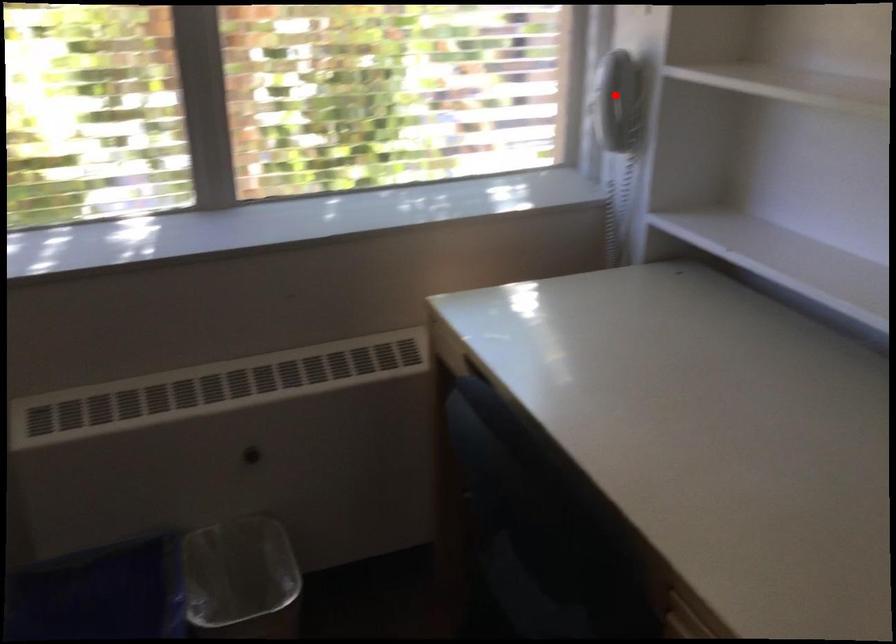
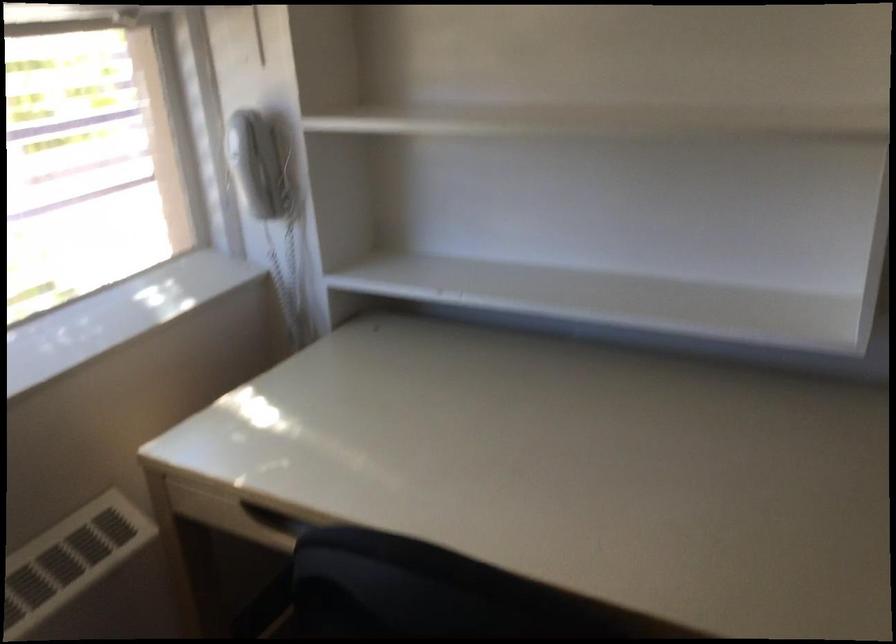
In the second image, find the point that corresponds to the highlighted location in the first image.

(261, 165)